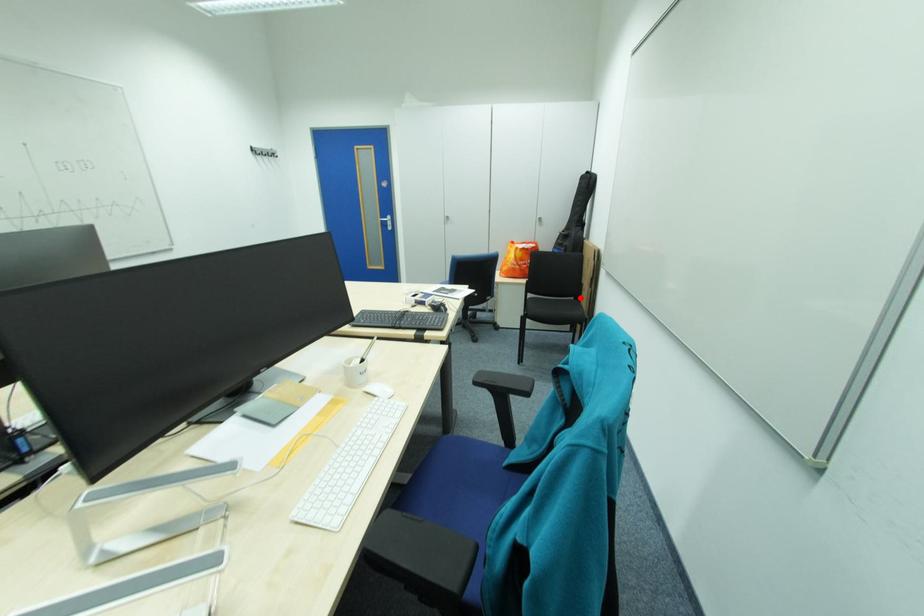
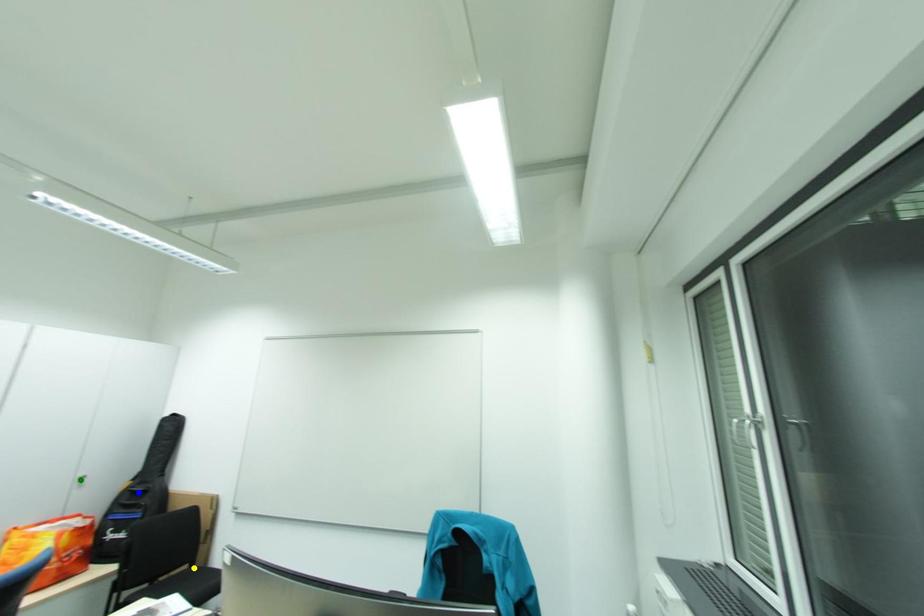
Question: I am providing you with two images of the same scene from different viewpoints. A red point is marked on the first image. You are given multiple points on the second image. Can you choose the point in image 2 that corresponds to the point in image 1?

Choices:
 (A) yellow point
 (B) blue point
 (C) green point

Answer: (A)